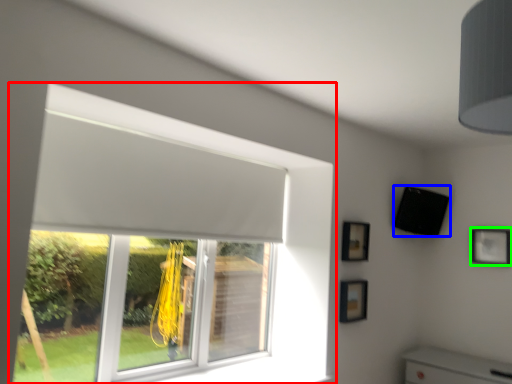
Question: Based on their relative distances, which object is farther from window (highlighted by a red box)? Choose from speaker (highlighted by a blue box) and picture frame (highlighted by a green box).

Choices:
 (A) speaker
 (B) picture frame

Answer: (B)